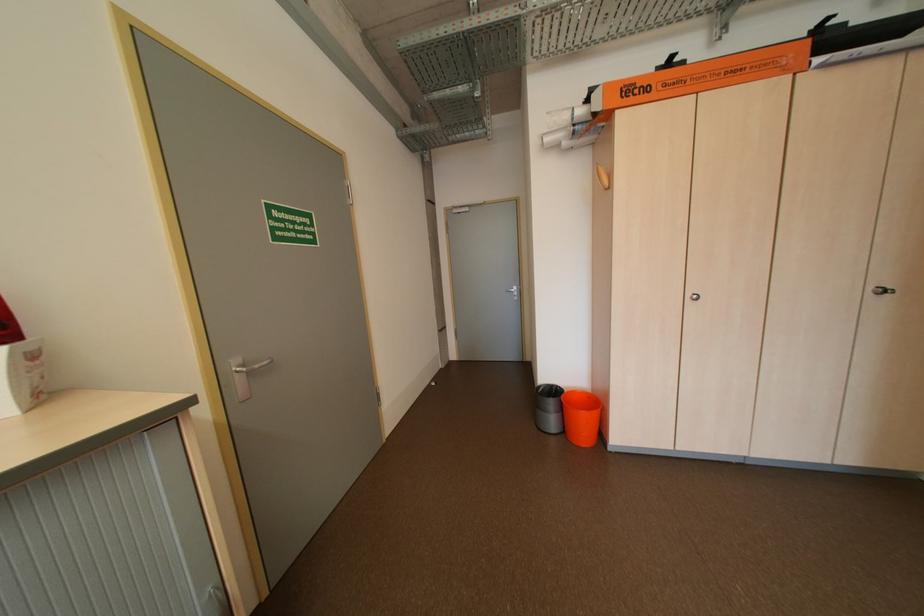
What do you see at coordinates (244, 376) in the screenshot? This screenshot has width=924, height=616. I see `the metal door handle` at bounding box center [244, 376].